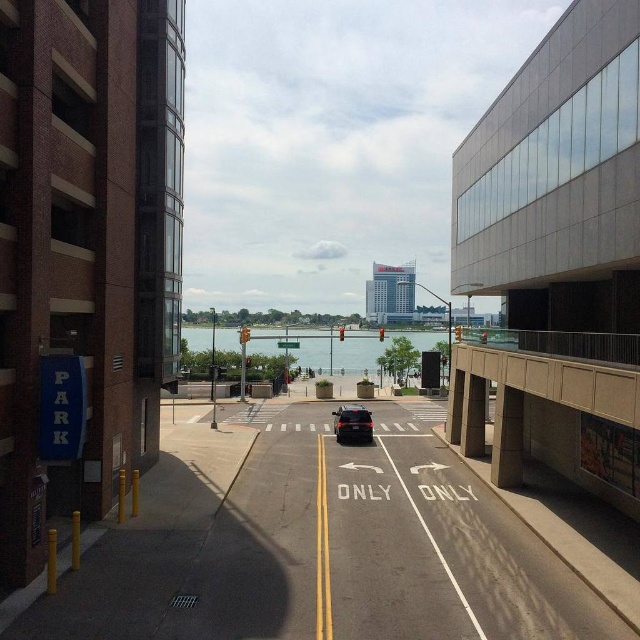
Is point (548, 403) in front of point (340, 417)?

Yes, it is.

Is concrete overpass at right further to the viewer compared to shiny black sedan at center?

No.

Does point (561, 410) come farther from viewer compared to point (362, 426)?

No, it is not.

Find the location of a particular element. This screenshot has height=640, width=640. concrete overpass at right is located at coordinates (540, 413).

Who is positioned more to the left, gray concrete parking garage at right or clear glass water at center?

Positioned to the left is clear glass water at center.

Where is `gray concrete parking garage at right`? This screenshot has width=640, height=640. gray concrete parking garage at right is located at coordinates (557, 180).

Locate an element on the screen. gray concrete parking garage at right is located at coordinates (557, 180).

Where is `clear glass water at center`? This screenshot has height=640, width=640. clear glass water at center is located at coordinates (374, 348).

Is point (369, 348) in front of point (355, 432)?

No, it is behind (355, 432).

The image size is (640, 640). Describe the element at coordinates (374, 348) in the screenshot. I see `clear glass water at center` at that location.

You are a GUI agent. You are given a task and a screenshot of the screen. Output one action in this format:
    pyautogui.click(x=<x>, y=<y>)
    Task: Click on the clear glass water at center
    This screenshot has width=640, height=640.
    Given the screenshot: What is the action you would take?
    pyautogui.click(x=374, y=348)